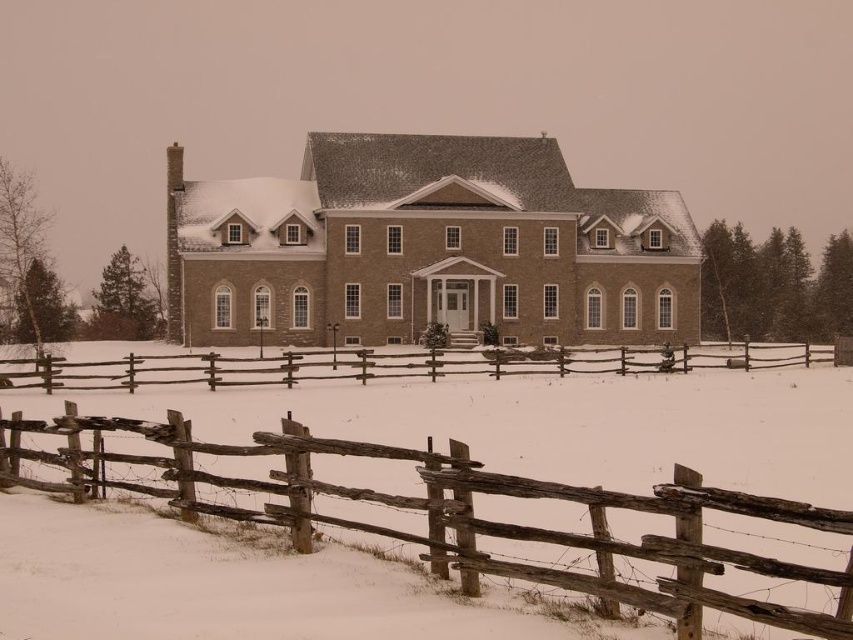
Question: Can you confirm if weathered wood fence at lower center is positioned below weathered wood fence at center?

Choices:
 (A) yes
 (B) no

Answer: (A)

Question: Among these points, which one is nearest to the camera?

Choices:
 (A) (454, 557)
 (B) (521, 368)

Answer: (A)

Question: Which point is farther to the camera?

Choices:
 (A) weathered wood fence at lower center
 (B) weathered wood fence at center

Answer: (B)

Question: Which of the following is the farthest from the observer?

Choices:
 (A) weathered wood fence at lower center
 (B) weathered wood fence at center

Answer: (B)

Question: Is weathered wood fence at lower center wider than weathered wood fence at center?

Choices:
 (A) no
 (B) yes

Answer: (A)

Question: Does weathered wood fence at lower center appear under weathered wood fence at center?

Choices:
 (A) no
 (B) yes

Answer: (B)